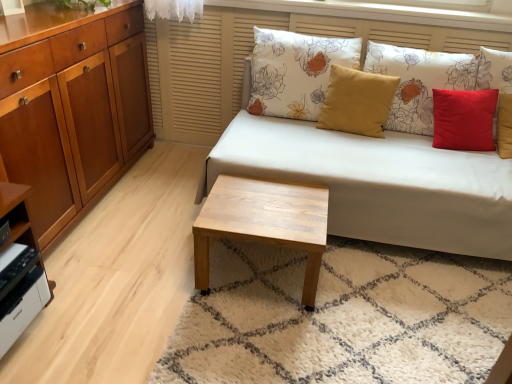
Image resolution: width=512 pixels, height=384 pixels. Identify the location of vacant region in front of light wood/texture coffee table at center. (262, 338).